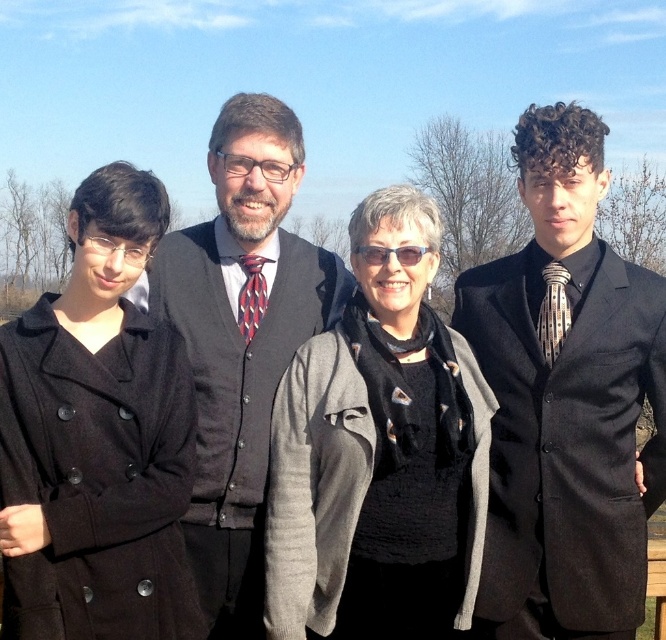
Based on the photo, what is the position of the black textured scarf at center in the image?

The black textured scarf at center is located at point (380, 451).

You are a photographer who needs to adjust the lighting to ensure both the black textured scarf at center and the red and black striped tie at center are well lit. Since the scarf is taller than the tie, which object might require more upward adjustment of the light source to avoid shadows?

The black textured scarf at center is taller than the red and black striped tie at center, so the light source might need to be adjusted upward more for the scarf to prevent shadows from obscuring it.